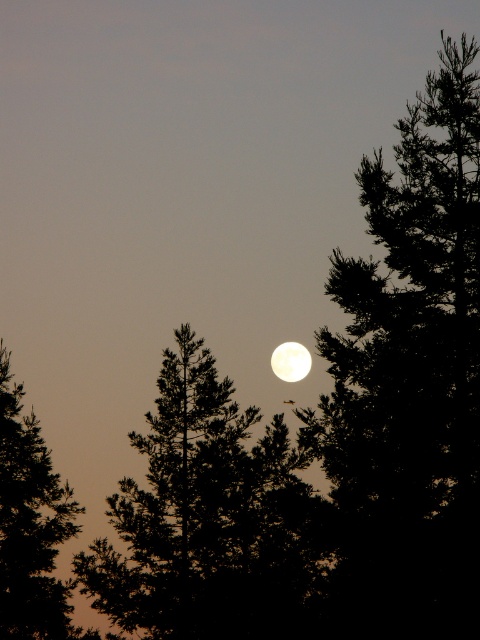
Question: Which object is closer to the camera taking this photo?

Choices:
 (A) silhouette pine tree at center
 (B) dark green leafy tree at left
 (C) bright white sphere at center
 (D) silhouette tree at right

Answer: (D)

Question: From the image, what is the correct spatial relationship of silhouette tree at right in relation to silhouette pine tree at center?

Choices:
 (A) below
 (B) above

Answer: (B)

Question: Does silhouette pine tree at center appear over dark green leafy tree at left?

Choices:
 (A) no
 (B) yes

Answer: (A)

Question: Which object is farther from the camera taking this photo?

Choices:
 (A) silhouette pine tree at center
 (B) silhouette tree at right
 (C) bright white sphere at center
 (D) dark green leafy tree at left

Answer: (C)

Question: In this image, where is silhouette pine tree at center located relative to dark green leafy tree at left?

Choices:
 (A) above
 (B) below

Answer: (B)

Question: Based on their relative distances, which object is nearer to the dark green leafy tree at left?

Choices:
 (A) silhouette pine tree at center
 (B) bright white sphere at center
 (C) silhouette tree at right

Answer: (A)